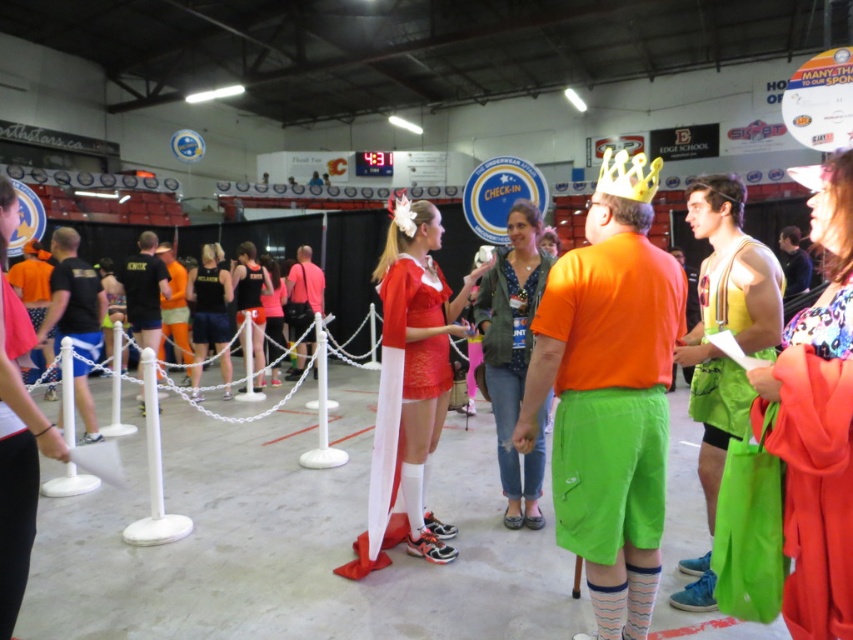
Can you confirm if yellow tank top at center is bigger than black mesh t-shirt at left?

Correct, yellow tank top at center is larger in size than black mesh t-shirt at left.

Does point (724, 394) come in front of point (55, 323)?

That is True.

Where is `yellow tank top at center`? The width and height of the screenshot is (853, 640). yellow tank top at center is located at coordinates (726, 321).

Which is more to the left, white matte leggings at lower left or black jersey at center?

black jersey at center is more to the left.

Between white matte leggings at lower left and black jersey at center, which one is positioned higher?

black jersey at center is higher up.

Consider the image. Measure the distance between white matte leggings at lower left and camera.

1.92 meters

Locate an element on the screen. The height and width of the screenshot is (640, 853). white matte leggings at lower left is located at coordinates (15, 468).

Is matte orange shirt at center bigger than black jersey at center?

Yes.

Looking at this image, can you confirm if matte orange shirt at center is positioned to the left of black jersey at center?

No, matte orange shirt at center is not to the left of black jersey at center.

Where is `matte orange shirt at center`? matte orange shirt at center is located at coordinates (303, 305).

You are a GUI agent. You are given a task and a screenshot of the screen. Output one action in this format:
    pyautogui.click(x=<x>, y=<y>)
    Task: Click on the matte orange shirt at center
    The image size is (853, 640).
    Given the screenshot: What is the action you would take?
    pyautogui.click(x=303, y=305)